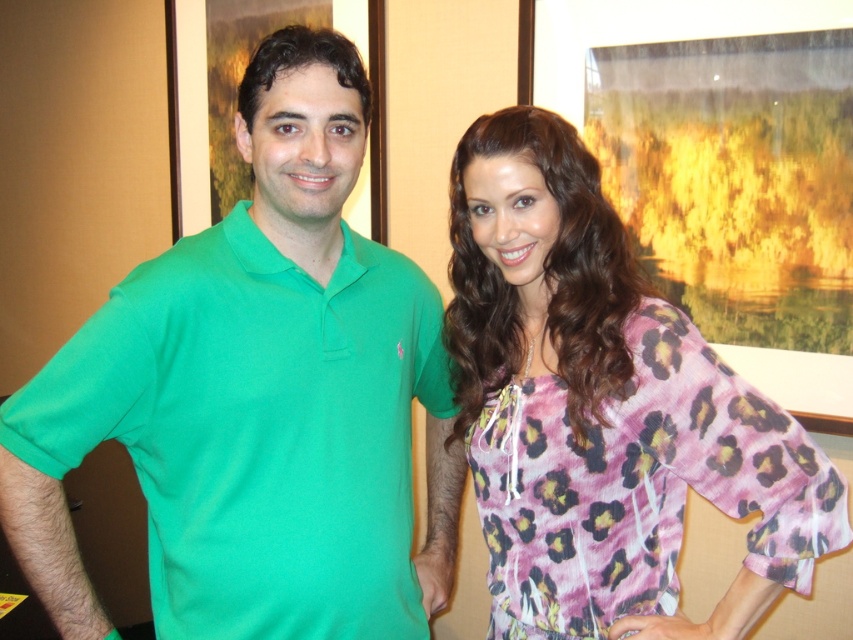
Where is `green polo shirt at left`? The image size is (853, 640). green polo shirt at left is located at coordinates (257, 397).

Who is more distant from viewer, (67,385) or (585,385)?

The point (585,385) is behind.

The width and height of the screenshot is (853, 640). In order to click on green polo shirt at left in this screenshot , I will do `click(257, 397)`.